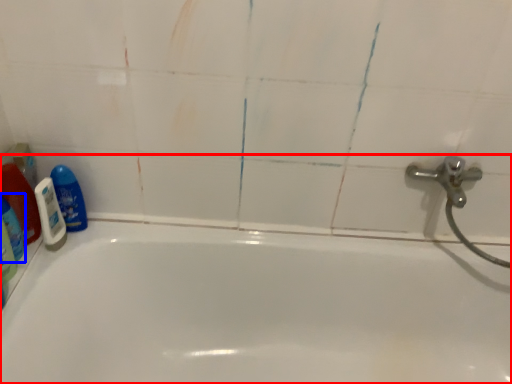
Question: Which object appears farthest to the camera in this image, bathtub (highlighted by a red box) or cleaning product (highlighted by a blue box)?

Choices:
 (A) bathtub
 (B) cleaning product

Answer: (B)